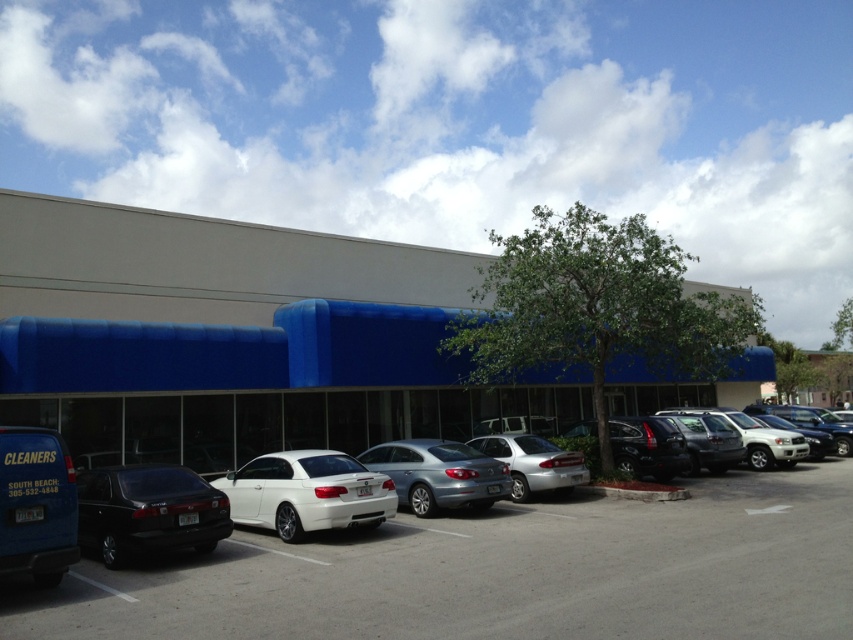
Question: Is blue awning at center bigger than satin silver suv at right?

Choices:
 (A) no
 (B) yes

Answer: (B)

Question: Considering the real-world distances, which object is farthest from the shiny black sedan at left?

Choices:
 (A) shiny black suv at center
 (B) satin silver sedan at center
 (C) blue awning at center
 (D) silver metallic sedan at center

Answer: (A)

Question: Does satin silver sedan at center lie behind shiny black suv at center?

Choices:
 (A) no
 (B) yes

Answer: (A)

Question: Which of the following is the farthest from the observer?

Choices:
 (A) (532, 472)
 (B) (263, 380)
 (C) (833, 630)

Answer: (B)

Question: Is satin silver sedan at center positioned at the back of shiny black suv at center?

Choices:
 (A) yes
 (B) no

Answer: (B)

Question: Which of these objects is positioned closest to the satin silver sedan at center?

Choices:
 (A) white glossy car at center
 (B) silver metallic sedan at center
 (C) shiny black suv at center
 (D) shiny black sedan at left

Answer: (B)